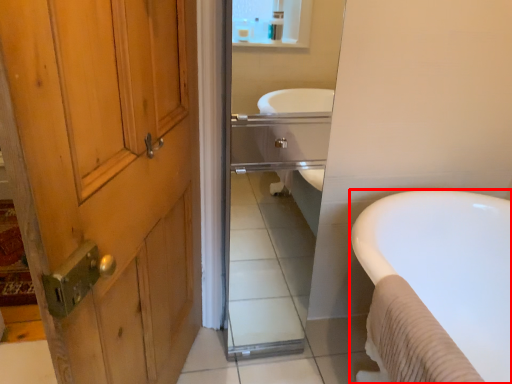
Question: From the image's perspective, considering the relative positions of bathtub (annotated by the red box) and mirror in the image provided, where is bathtub (annotated by the red box) located with respect to the staircase?

Choices:
 (A) below
 (B) above

Answer: (A)